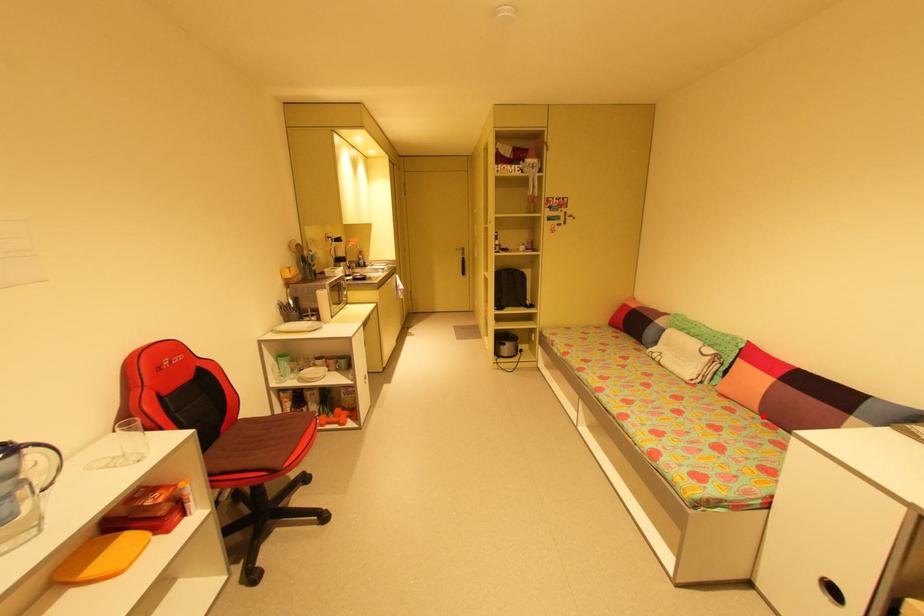
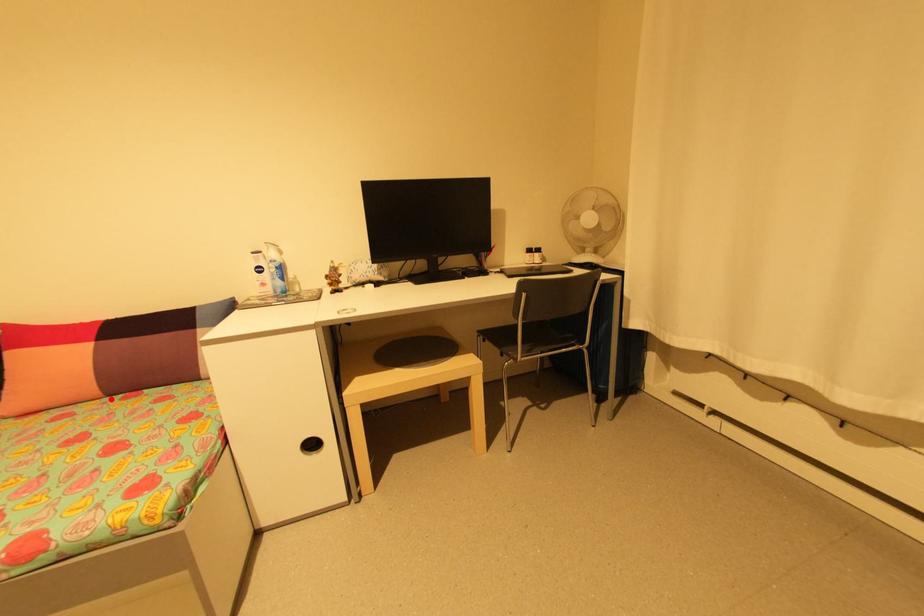
I am providing you with two images of the same scene from different viewpoints. A red point is marked on the first image and another point is marked on the second image. Does the point marked in image1 correspond to the same location as the one in image2?

Yes